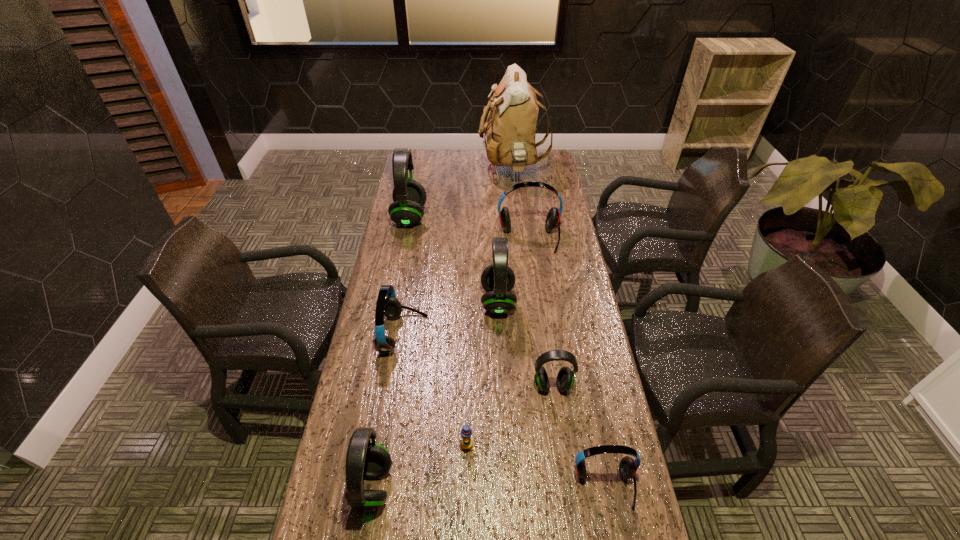
The width and height of the screenshot is (960, 540). In order to click on free location located 0.210m on the ear cups of the second farthest black headset in this screenshot , I will do `click(420, 301)`.

Identify the location of free space located 0.170m on the ear cups of the second farthest black headset. The height and width of the screenshot is (540, 960). (432, 301).

The width and height of the screenshot is (960, 540). Find the location of `vacant space located 0.280m with the microphone attached to the side of the farthest red headset`. vacant space located 0.280m with the microphone attached to the side of the farthest red headset is located at coordinates (538, 307).

Find the location of `free space located on the ear cups of the second smallest black headset`. free space located on the ear cups of the second smallest black headset is located at coordinates (486, 487).

What are the coordinates of `free spot located with the microphone attached to the side of the leftmost red headset` in the screenshot? It's located at (469, 334).

Where is `free point located on the ear cups of the sixth farthest object`? This screenshot has width=960, height=540. free point located on the ear cups of the sixth farthest object is located at coordinates (559, 433).

The height and width of the screenshot is (540, 960). In order to click on vacant area situated 0.060m with the microphone attached to the side of the nearest red headset in this screenshot , I will do `click(615, 539)`.

This screenshot has width=960, height=540. Find the location of `vacant region located 0.070m on the face of the yellow duckling, where the monocle is placed`. vacant region located 0.070m on the face of the yellow duckling, where the monocle is placed is located at coordinates (466, 480).

Find the location of a particular element. The width and height of the screenshot is (960, 540). object present at the far edge is located at coordinates (510, 130).

Find the location of a particular element. This screenshot has height=540, width=960. backpack at the right edge is located at coordinates (510, 130).